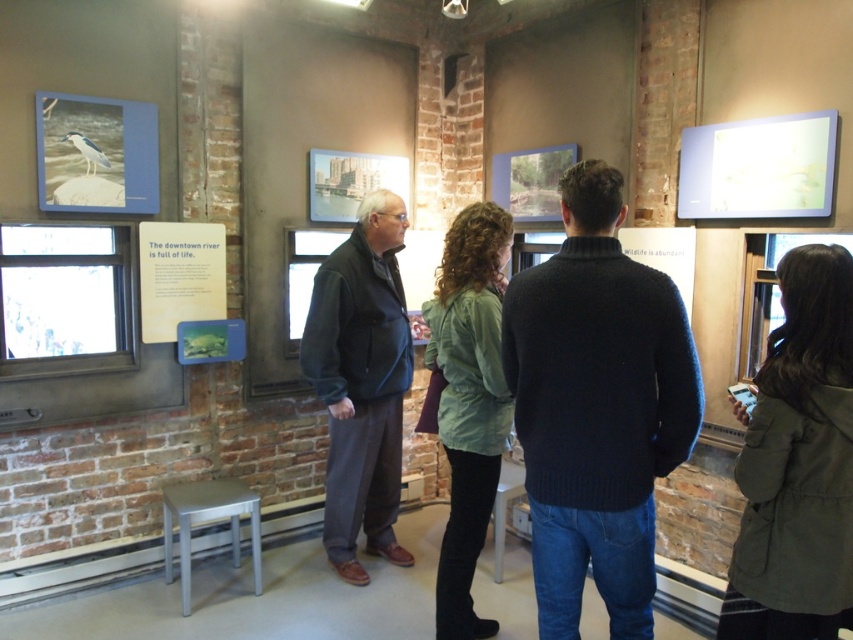
Question: Which object appears farthest from the camera in this image?

Choices:
 (A) matte plastic poster at center
 (B) green matte jacket at lower right

Answer: (A)

Question: Which of the following is the farthest from the observer?

Choices:
 (A) dark blue jacket at center
 (B) white plastic stool at lower center

Answer: (B)

Question: Which of the following is the closest to the observer?

Choices:
 (A) white plastic stool at lower center
 (B) dark blue sweater at center
 (C) matte plastic poster at center
 (D) matte paper sign at left

Answer: (B)

Question: Is dark blue jacket at center positioned before green matte jacket at center?

Choices:
 (A) no
 (B) yes

Answer: (A)

Question: Can you confirm if matte plastic poster at center is positioned to the left of white plastic stool at lower center?

Choices:
 (A) yes
 (B) no

Answer: (A)

Question: Is dark blue jacket at center wider than green matte jacket at center?

Choices:
 (A) no
 (B) yes

Answer: (B)